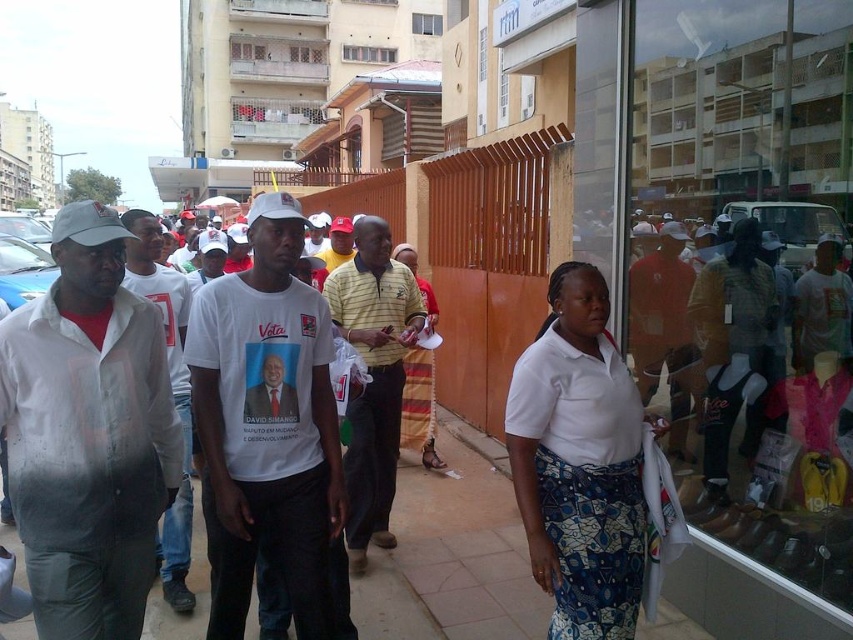
Between white matte t-shirt at center and white matte shirt at center, which one appears on the right side from the viewer's perspective?

From the viewer's perspective, white matte t-shirt at center appears more on the right side.

Identify the location of white matte t-shirt at center. The width and height of the screenshot is (853, 640). (270, 432).

The image size is (853, 640). I want to click on white matte t-shirt at center, so click(270, 432).

Between white matte shirt at left and white matte shirt at center, which one has more height?

Standing taller between the two is white matte shirt at center.

Is white matte shirt at left positioned at the back of white matte shirt at center?

No, it is in front of white matte shirt at center.

The width and height of the screenshot is (853, 640). What are the coordinates of `white matte shirt at left` in the screenshot? It's located at (88, 433).

Identify the location of white matte shirt at left. (88, 433).

Who is higher up, yellow polo shirt at center or white matte shirt at center?

yellow polo shirt at center is above.

Locate an element on the screen. This screenshot has height=640, width=853. yellow polo shirt at center is located at coordinates (373, 376).

Is point (352, 476) in front of point (170, 310)?

No, it is not.

Locate an element on the screen. This screenshot has width=853, height=640. yellow polo shirt at center is located at coordinates (373, 376).